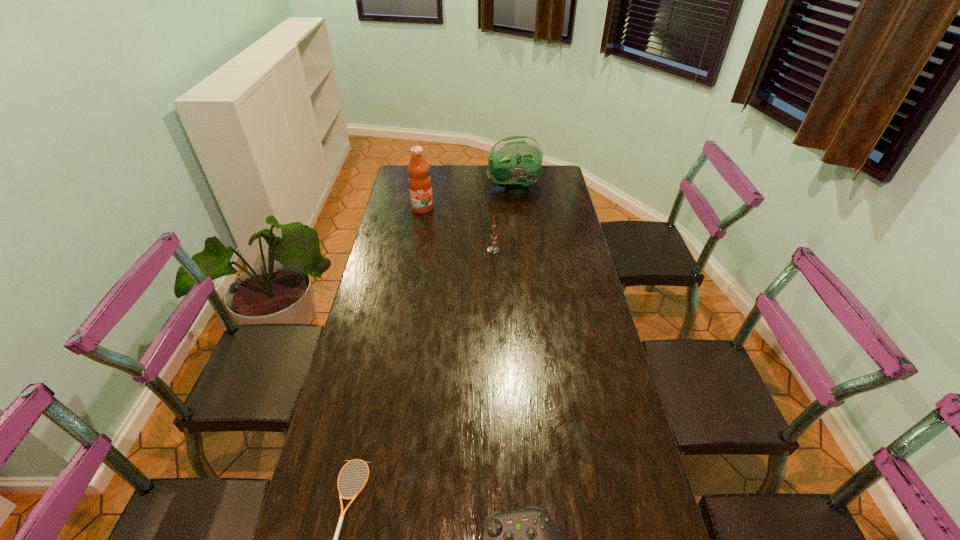
The width and height of the screenshot is (960, 540). Identify the location of unoccupied area between the second farthest object and the football helmet. (468, 199).

This screenshot has height=540, width=960. In order to click on object that is the third closest to the second shortest object in this screenshot , I will do `click(420, 187)`.

Locate an element on the screen. The width and height of the screenshot is (960, 540). object that stands as the fourth closest to the fourth tallest object is located at coordinates (515, 162).